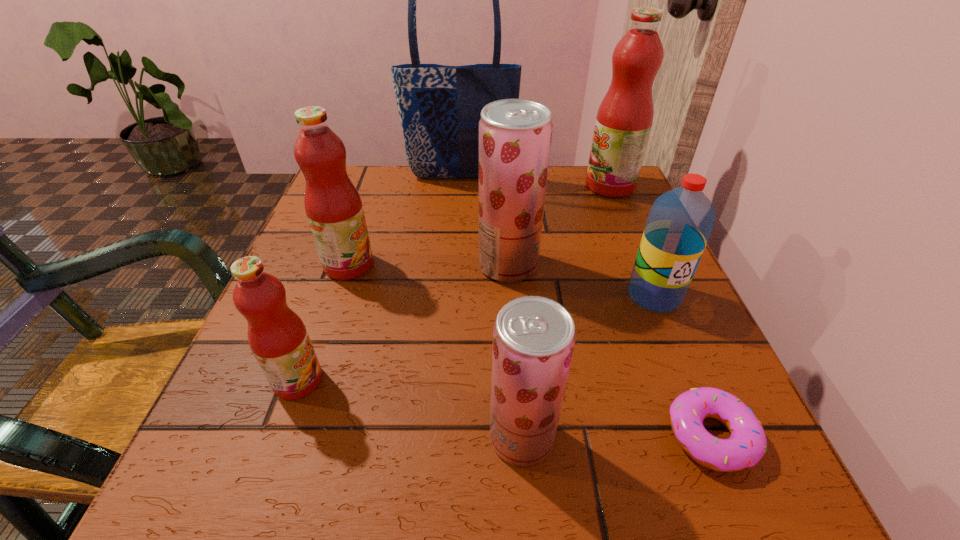
The image size is (960, 540). I want to click on free space located 0.370m on the front label of the nearest pink fruit juice, so click(572, 380).

Find the location of a particular element. The height and width of the screenshot is (540, 960). vacant region located 0.310m on the left of the doughnut is located at coordinates (435, 435).

Locate an element on the screen. The width and height of the screenshot is (960, 540). shopping bag located in the far edge section of the desktop is located at coordinates (440, 106).

Find the location of a particular element. This screenshot has height=540, width=960. fruit juice present at the far edge is located at coordinates (624, 119).

At what (x,y) coordinates should I click in order to perform the action: click on fruit juice located in the near edge section of the desktop. Please return your answer as a coordinate pair (x, y). This screenshot has width=960, height=540. Looking at the image, I should click on (533, 337).

The height and width of the screenshot is (540, 960). I want to click on doughnut located at the near edge, so click(747, 444).

The width and height of the screenshot is (960, 540). What are the coordinates of `fruit juice positioned at the right edge` in the screenshot? It's located at (624, 119).

You are a GUI agent. You are given a task and a screenshot of the screen. Output one action in this format:
    pyautogui.click(x=<x>, y=<y>)
    Task: Click on the water bottle present at the right edge
    This screenshot has width=960, height=540.
    Given the screenshot: What is the action you would take?
    pyautogui.click(x=680, y=222)

Locate an element on the screen. The image size is (960, 540). doughnut situated at the right edge is located at coordinates (747, 444).

Locate an element on the screen. The image size is (960, 540). object present at the far right corner is located at coordinates point(624,119).